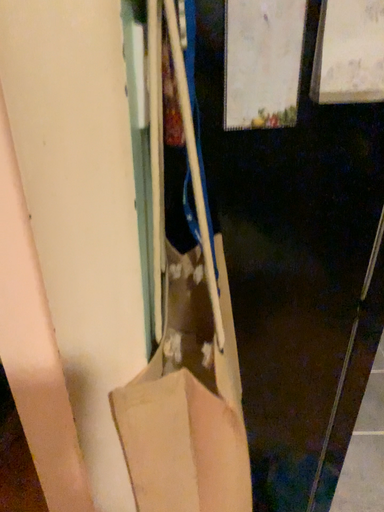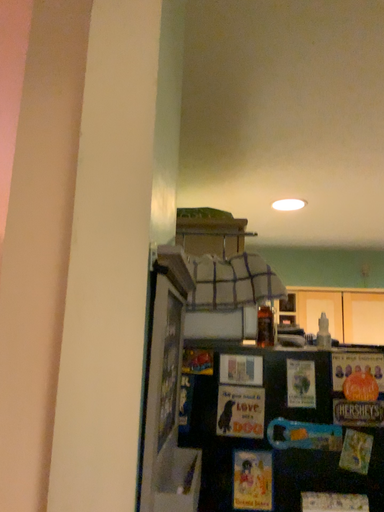
Question: Which way did the camera rotate in the video?

Choices:
 (A) rotated downward
 (B) rotated upward

Answer: (B)